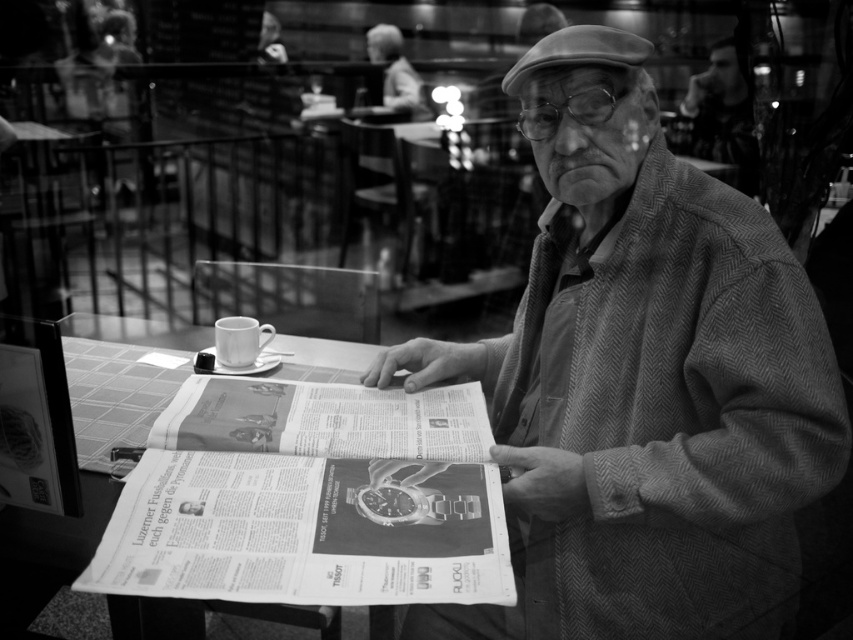
Question: Among these objects, which one is farthest from the camera?

Choices:
 (A) herringbone wool coat at center
 (B) paper at center

Answer: (B)

Question: Which of the following is the closest to the observer?

Choices:
 (A) (575, 42)
 (B) (86, 385)

Answer: (A)

Question: Is herringbone wool coat at center above paper at center?

Choices:
 (A) yes
 (B) no

Answer: (A)

Question: Can you confirm if herringbone wool coat at center is wider than paper at center?

Choices:
 (A) yes
 (B) no

Answer: (B)

Question: Does herringbone wool coat at center have a lesser width compared to paper at center?

Choices:
 (A) yes
 (B) no

Answer: (A)